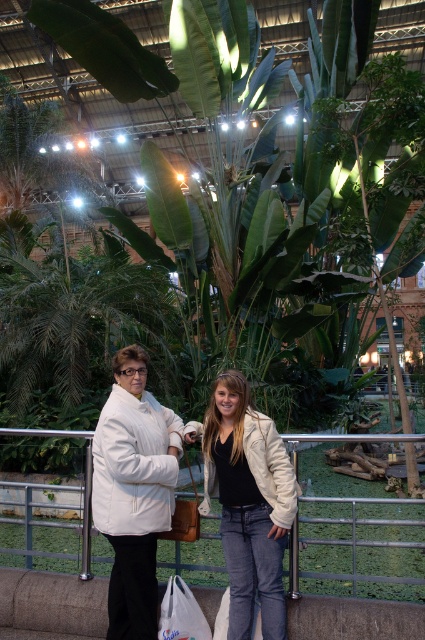
Question: Which point is closer to the camera taking this photo?

Choices:
 (A) (112, 595)
 (B) (206, 621)
 (C) (257, 586)
 (D) (50, 524)

Answer: (C)

Question: Which object appears farthest from the camera in this image?

Choices:
 (A) white fabric bag at lower center
 (B) metal/rustic fence at lower center
 (C) white matte jacket at left

Answer: (B)

Question: Which point appears closest to the camera in this image?

Choices:
 (A) (33, 433)
 (B) (110, 476)
 (C) (187, 595)

Answer: (B)

Question: Does metal/rustic fence at lower center appear on the right side of white fabric bag at lower center?

Choices:
 (A) yes
 (B) no

Answer: (B)

Question: Does white matte jacket at left have a smaller size compared to metal/rustic fence at lower center?

Choices:
 (A) no
 (B) yes

Answer: (A)

Question: Can you confirm if denim jacket at center is smaller than metal/rustic fence at lower center?

Choices:
 (A) yes
 (B) no

Answer: (B)